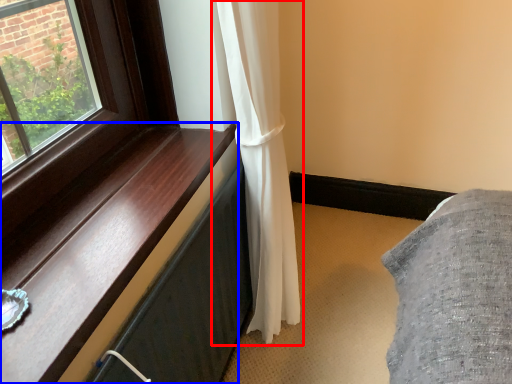
Question: Which point is closer to the camera, curtain (highlighted by a red box) or window sill (highlighted by a blue box)?

Choices:
 (A) curtain
 (B) window sill

Answer: (B)